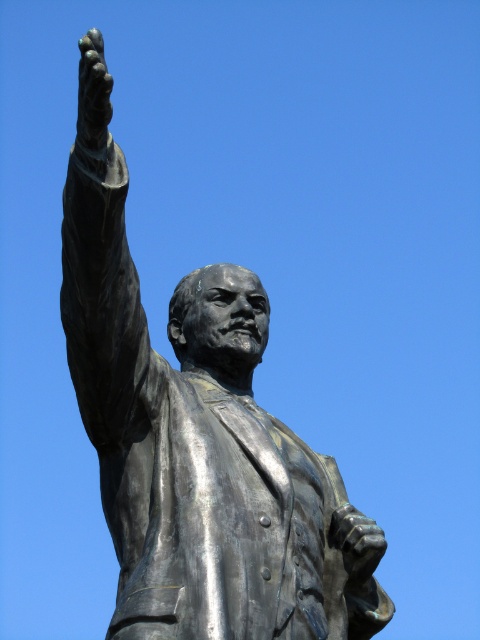
You are an art conservator assessing the statue. You notice the bronze statue at upper center and the polished bronze hand at upper left. Which object is shorter in height?

The bronze statue at upper center is shorter in height compared to the polished bronze hand at upper left according to the description.

You are standing in front of the statue of the historical figure. There is a point marked at coordinates (201, 449). What object is located at this point?

The bronze statue at upper center is located at point (201, 449).

In the scene shown: You are standing in front of the statue and want to take a photo that includes both the bronze statue at upper center and the polished bronze hand at upper left. Based on their positions, which object should you place on the right side of your camera frame?

The bronze statue at upper center should be placed on the right side of your camera frame because it is positioned on the right side of the polished bronze hand at upper left.